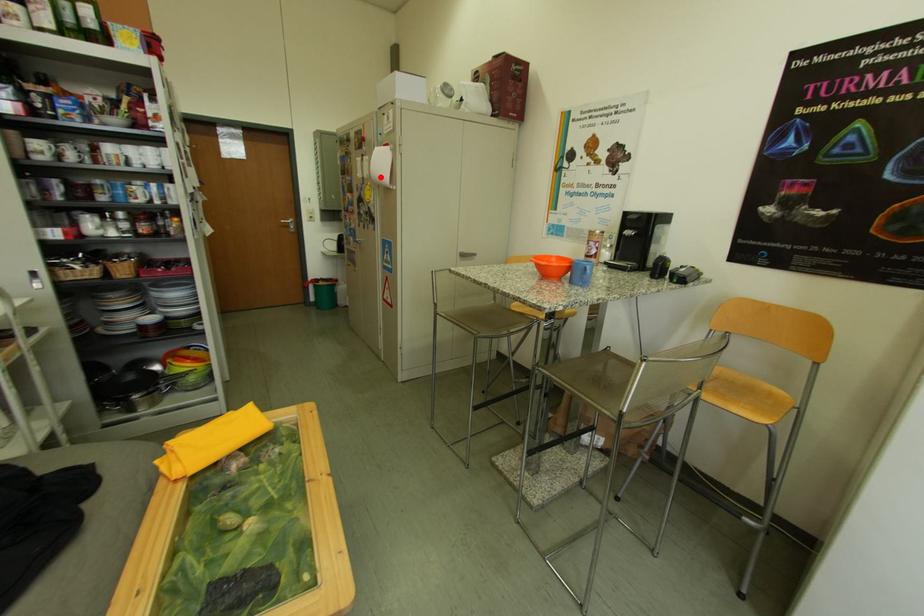
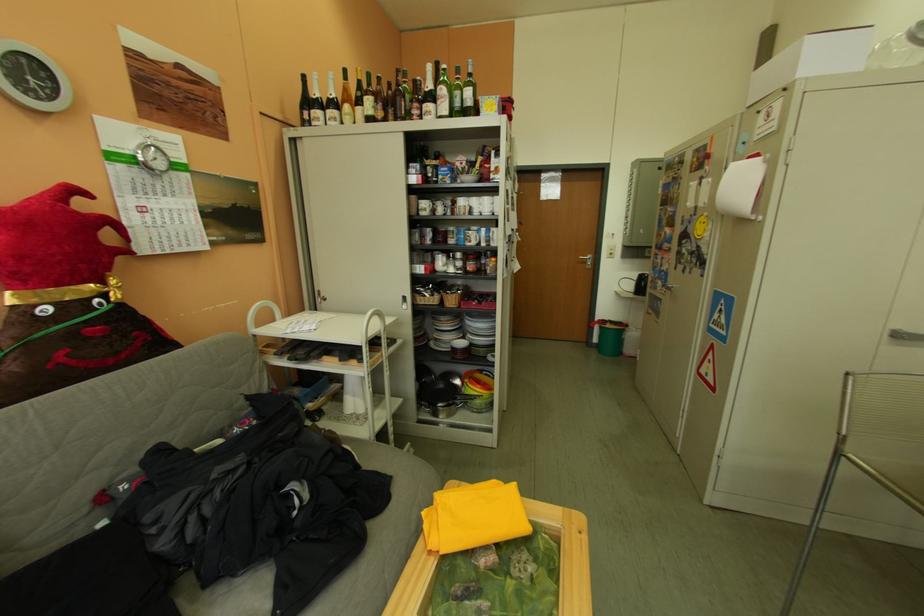
Where in the second image is the point corresponding to the highlighted location from the first image?

(720, 204)